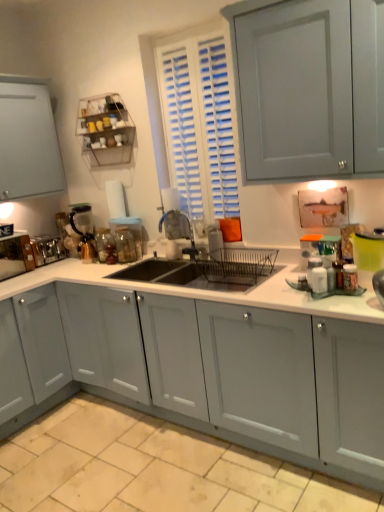
I want to click on vacant space situated above beige tile at lower center (from a real-world perspective), so click(127, 462).